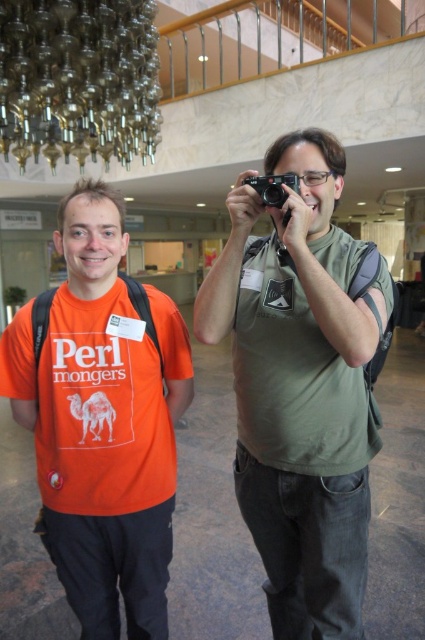
Question: Does green matte shirt at center have a smaller size compared to orange cotton t-shirt at left?

Choices:
 (A) no
 (B) yes

Answer: (A)

Question: Which point is closer to the camera?

Choices:
 (A) green matte shirt at center
 (B) orange cotton t-shirt at left

Answer: (A)

Question: Which object appears closest to the camera in this image?

Choices:
 (A) orange cotton t-shirt at left
 (B) green matte shirt at center

Answer: (B)

Question: Does green matte shirt at center appear over orange cotton t-shirt at left?

Choices:
 (A) no
 (B) yes

Answer: (A)

Question: Which point appears farthest from the camera in this image?

Choices:
 (A) (113, 488)
 (B) (272, 205)
 (C) (343, 433)

Answer: (A)

Question: Does green matte shirt at center have a lesser width compared to black plastic camera at center?

Choices:
 (A) yes
 (B) no

Answer: (B)